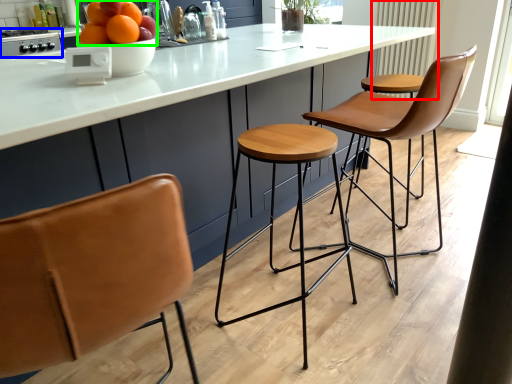
Question: Which object is positioned farthest from radiator (highlighted by a red box)? Select from appliance (highlighted by a blue box) and fruit (highlighted by a green box).

Choices:
 (A) appliance
 (B) fruit

Answer: (A)